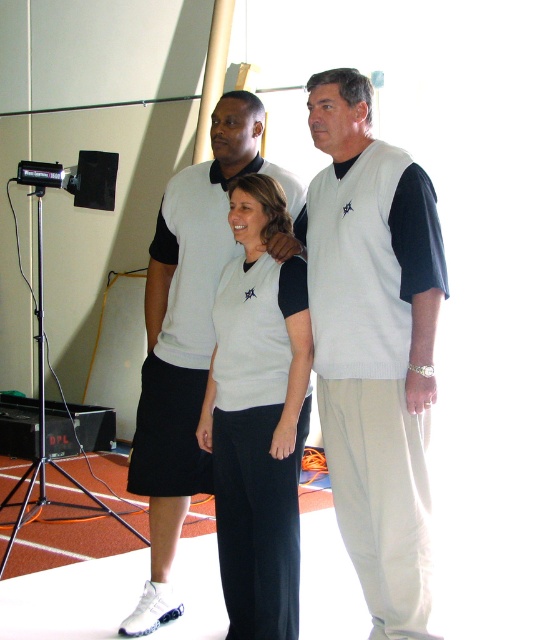
Question: Observing the image, what is the correct spatial positioning of white knitted vest at center in reference to white knit sweater at center?

Choices:
 (A) left
 (B) right

Answer: (B)

Question: Which point appears closest to the camera in this image?

Choices:
 (A) (406, 180)
 (B) (207, 406)

Answer: (A)

Question: Among these objects, which one is nearest to the camera?

Choices:
 (A) white knitted vest at center
 (B) white knit vest at center
 (C) white knit sweater at center

Answer: (A)

Question: Which point is closer to the camera taking this photo?

Choices:
 (A) (146, 289)
 (B) (314, 218)

Answer: (B)

Question: Is white knit vest at center to the right of white knit sweater at center from the viewer's perspective?

Choices:
 (A) yes
 (B) no

Answer: (A)

Question: Is the position of white knitted vest at center more distant than that of white knit vest at center?

Choices:
 (A) no
 (B) yes

Answer: (A)